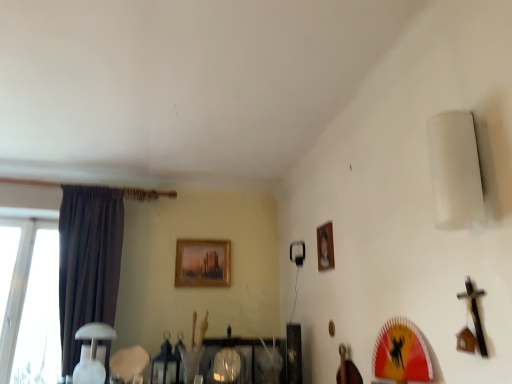
Question: Considering the relative sizes of wooden picture frame at upper center, which appears as the 2th picture frame when viewed from the back, and white glossy table lamp at lower left in the image provided, is wooden picture frame at upper center, which appears as the 2th picture frame when viewed from the back, taller than white glossy table lamp at lower left?

Choices:
 (A) yes
 (B) no

Answer: (B)

Question: Is wooden picture frame at upper center, the 1th picture frame in the right-to-left sequence, to the left of white glossy table lamp at lower left from the viewer's perspective?

Choices:
 (A) yes
 (B) no

Answer: (B)

Question: Does wooden picture frame at upper center, the first picture frame when ordered from front to back, have a greater width compared to white glossy table lamp at lower left?

Choices:
 (A) no
 (B) yes

Answer: (A)

Question: Is wooden picture frame at upper center, the first picture frame when ordered from front to back, positioned before white glossy table lamp at lower left?

Choices:
 (A) yes
 (B) no

Answer: (A)

Question: From the image's perspective, is wooden picture frame at upper center, the 1th picture frame in the right-to-left sequence, beneath white glossy table lamp at lower left?

Choices:
 (A) yes
 (B) no

Answer: (B)

Question: From a real-world perspective, is wooden picture frame at upper center, the 1th picture frame in the right-to-left sequence, physically above white glossy table lamp at lower left?

Choices:
 (A) no
 (B) yes

Answer: (B)

Question: From the image's perspective, would you say wooden picture frame at upper center, placed as the second picture frame when sorted from left to right, is shown under dark fabric curtain at left?

Choices:
 (A) no
 (B) yes

Answer: (A)

Question: Is wooden picture frame at upper center, which appears as the 2th picture frame when viewed from the back, at the right side of dark fabric curtain at left?

Choices:
 (A) no
 (B) yes

Answer: (B)

Question: Can we say wooden picture frame at upper center, the first picture frame when ordered from front to back, lies outside dark fabric curtain at left?

Choices:
 (A) yes
 (B) no

Answer: (A)

Question: Is wooden picture frame at upper center, which appears as the 2th picture frame when viewed from the back, turned away from dark fabric curtain at left?

Choices:
 (A) no
 (B) yes

Answer: (A)

Question: Would you consider wooden picture frame at upper center, placed as the second picture frame when sorted from left to right, to be distant from dark fabric curtain at left?

Choices:
 (A) no
 (B) yes

Answer: (B)

Question: Is wooden picture frame at upper center, the 1th picture frame in the right-to-left sequence, next to dark fabric curtain at left?

Choices:
 (A) yes
 (B) no

Answer: (B)

Question: Considering the relative sizes of dark fabric curtain at left and wooden picture frame at upper center, which appears as the 2th picture frame when viewed from the back, in the image provided, is dark fabric curtain at left shorter than wooden picture frame at upper center, which appears as the 2th picture frame when viewed from the back,?

Choices:
 (A) no
 (B) yes

Answer: (A)